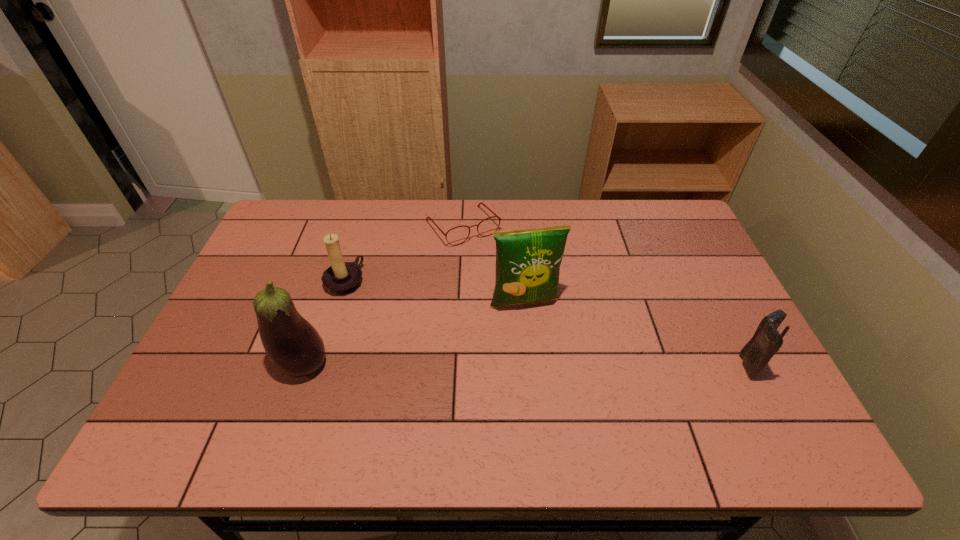
Find the location of `free space between the eggplant and the shortest object`. free space between the eggplant and the shortest object is located at coordinates (383, 296).

Image resolution: width=960 pixels, height=540 pixels. Find the location of `unoccupied position between the candle holder and the rightmost object`. unoccupied position between the candle holder and the rightmost object is located at coordinates (548, 323).

The width and height of the screenshot is (960, 540). I want to click on vacant space in between the cellular telephone and the candle holder, so click(548, 323).

Identify the location of free space that is in between the rightmost object and the eggplant. (528, 364).

Locate an element on the screen. The height and width of the screenshot is (540, 960). vacant area that lies between the candle holder and the rightmost object is located at coordinates tap(548, 323).

The width and height of the screenshot is (960, 540). I want to click on vacant point located between the spectacles and the eggplant, so click(383, 296).

The width and height of the screenshot is (960, 540). I want to click on vacant point located between the candle holder and the eggplant, so click(324, 323).

Where is `object that ranks as the closest to the eggplant`? object that ranks as the closest to the eggplant is located at coordinates (342, 278).

Where is `object that stands as the second closest to the crisp (potato chip)`? Image resolution: width=960 pixels, height=540 pixels. object that stands as the second closest to the crisp (potato chip) is located at coordinates (342, 278).

Locate an element on the screen. The height and width of the screenshot is (540, 960). vacant space that satisfies the following two spatial constraints: 1. on the front side of the cellular telephone; 2. on the keyboard of the eggplant is located at coordinates (303, 365).